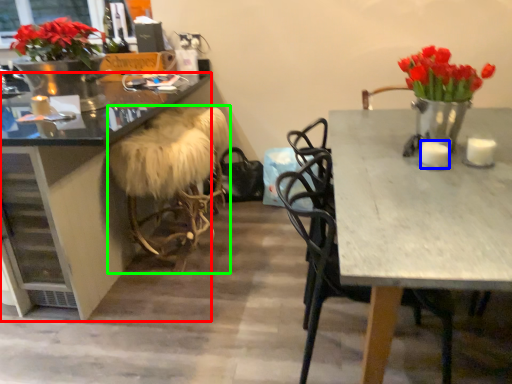
Question: Which is farther away from desk (highlighted by a red box)? candle (highlighted by a blue box) or stool (highlighted by a green box)?

Choices:
 (A) candle
 (B) stool

Answer: (A)